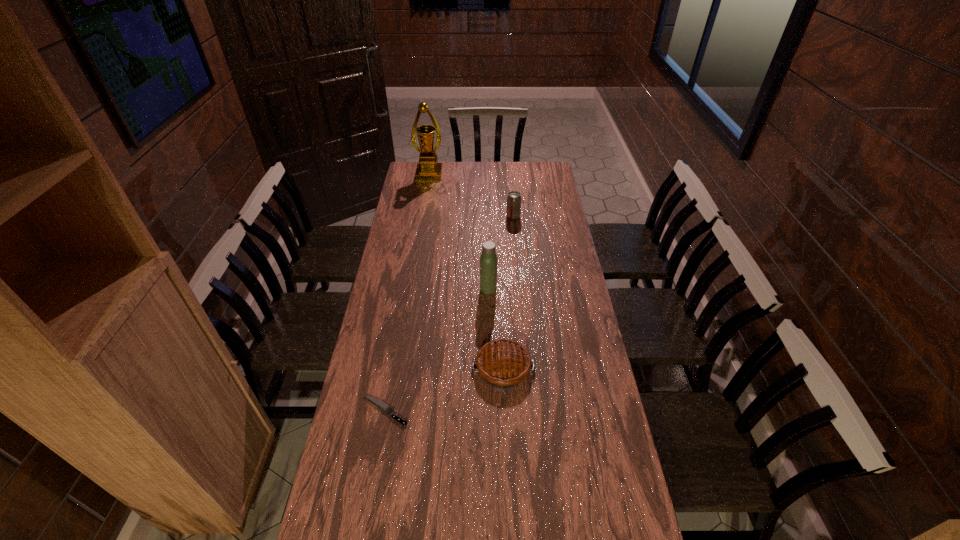
The width and height of the screenshot is (960, 540). Identify the location of vacant space that satisfies the following two spatial constraints: 1. on the front-facing side of the pie; 2. on the right side of the award. (397, 368).

This screenshot has width=960, height=540. In order to click on vacant space that satisfies the following two spatial constraints: 1. on the front-facing side of the award; 2. on the right side of the fourth farthest object in this screenshot , I will do click(x=397, y=368).

What are the coordinates of `vacant region that satisfies the following two spatial constraints: 1. on the front-facing side of the award; 2. on the left side of the soda can` in the screenshot? It's located at (422, 217).

Where is `blank area in the image that satisfies the following two spatial constraints: 1. on the front-facing side of the award; 2. on the right side of the second nearest object`? The width and height of the screenshot is (960, 540). blank area in the image that satisfies the following two spatial constraints: 1. on the front-facing side of the award; 2. on the right side of the second nearest object is located at coordinates (397, 368).